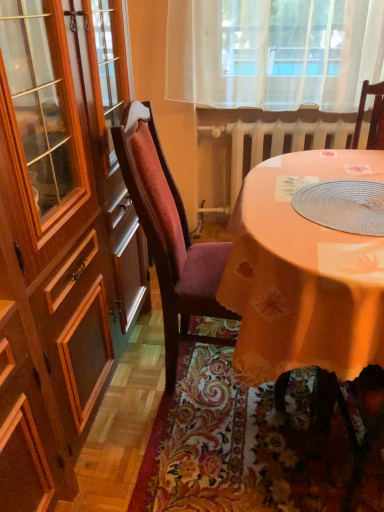
Question: In the image, is clear plastic placemat at center positioned in front of or behind silky orange tablecloth at lower center?

Choices:
 (A) behind
 (B) front

Answer: (B)

Question: Do you think clear plastic placemat at center is within silky orange tablecloth at lower center, or outside of it?

Choices:
 (A) inside
 (B) outside

Answer: (B)

Question: Which object is the farthest from the white painted metal radiator at center?

Choices:
 (A) clear plastic placemat at center
 (B) orange fabric table at center
 (C) velvet burgundy chair at center
 (D) silky orange tablecloth at lower center

Answer: (D)

Question: Which object is the closest to the silky orange tablecloth at lower center?

Choices:
 (A) clear plastic placemat at center
 (B) white painted metal radiator at center
 (C) velvet burgundy chair at center
 (D) orange fabric table at center

Answer: (C)